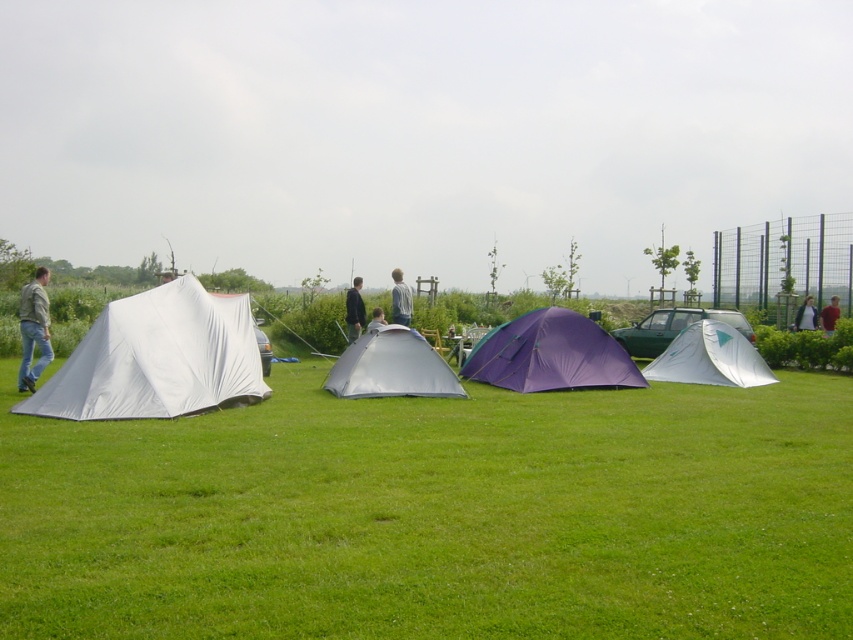
Is purple fabric tent at center thinner than red fabric shirt at center?

No.

Locate an element on the screen. Image resolution: width=853 pixels, height=640 pixels. purple fabric tent at center is located at coordinates (550, 355).

Is point (618, 360) closer to camera compared to point (827, 310)?

Yes.

The image size is (853, 640). Identify the location of purple fabric tent at center. (550, 355).

From the picture: Which of these two, dark gray jacket at center or gray fabric jacket at center, stands shorter?

dark gray jacket at center is shorter.

Can you confirm if dark gray jacket at center is taller than gray fabric jacket at center?

No.

The width and height of the screenshot is (853, 640). Find the location of `dark gray jacket at center`. dark gray jacket at center is located at coordinates (354, 310).

Can you confirm if green grass at lower center is positioned above purple fabric tent at center?

Actually, green grass at lower center is below purple fabric tent at center.

Does green grass at lower center have a lesser width compared to purple fabric tent at center?

In fact, green grass at lower center might be wider than purple fabric tent at center.

Identify the location of green grass at lower center. The width and height of the screenshot is (853, 640). (436, 515).